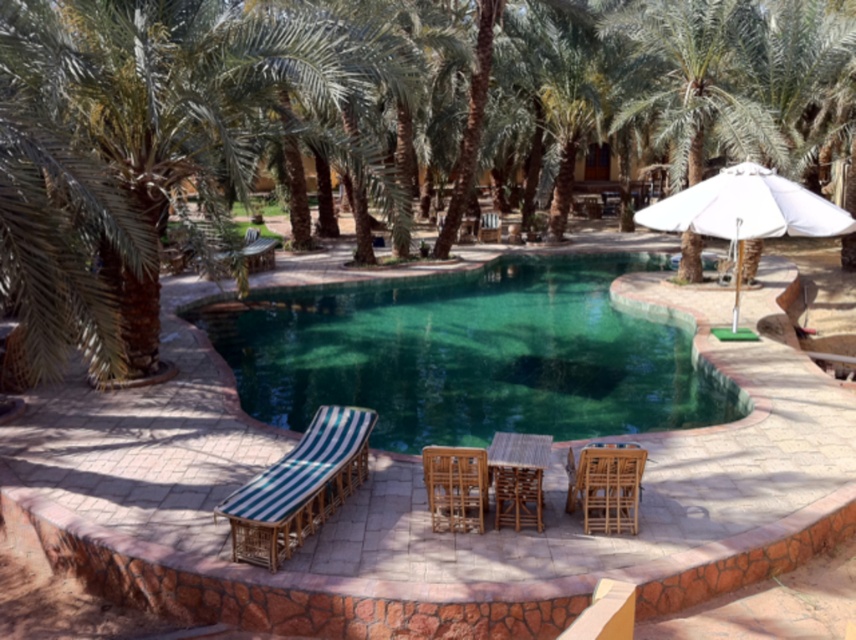
Question: Estimate the real-world distances between objects in this image. Which object is closer to the green glass swimming pool at center?

Choices:
 (A) green leafy palm tree at center
 (B) green striped fabric at lower left

Answer: (B)

Question: Is white fabric umbrella at upper right to the right of wooden chair at center from the viewer's perspective?

Choices:
 (A) no
 (B) yes

Answer: (B)

Question: Which of these objects is positioned closest to the wooden beach chair at lower right?

Choices:
 (A) green striped fabric at lower left
 (B) green leafy palm tree at center
 (C) wooden table at center

Answer: (C)

Question: Does green striped fabric at lower left appear under wooden chair at center?

Choices:
 (A) yes
 (B) no

Answer: (B)

Question: Is green glass swimming pool at center closer to camera compared to green leafy palm tree at center?

Choices:
 (A) yes
 (B) no

Answer: (B)

Question: Estimate the real-world distances between objects in this image. Which object is closer to the wooden beach chair at lower right?

Choices:
 (A) brown woven chair at center
 (B) green leafy palm tree at center
 (C) green glass swimming pool at center

Answer: (C)